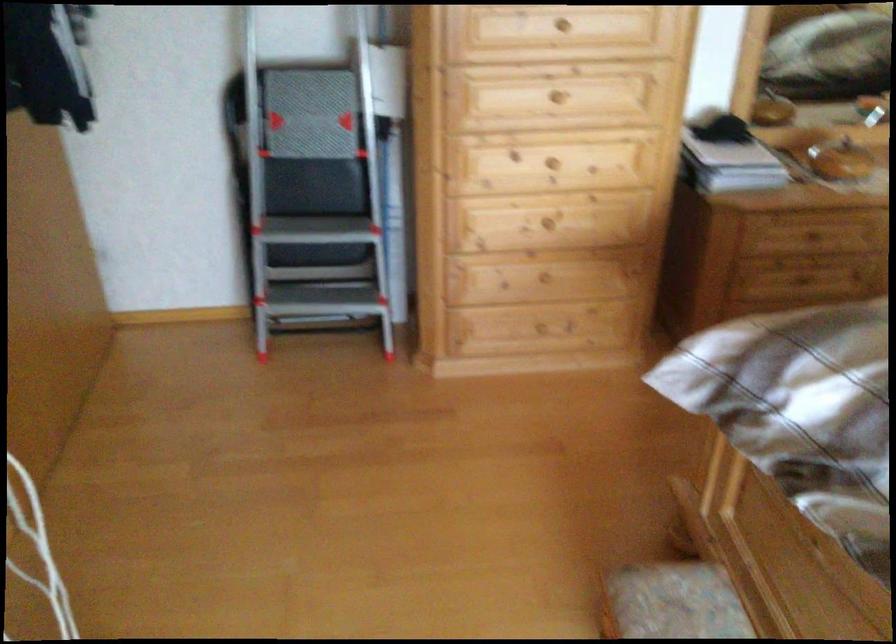
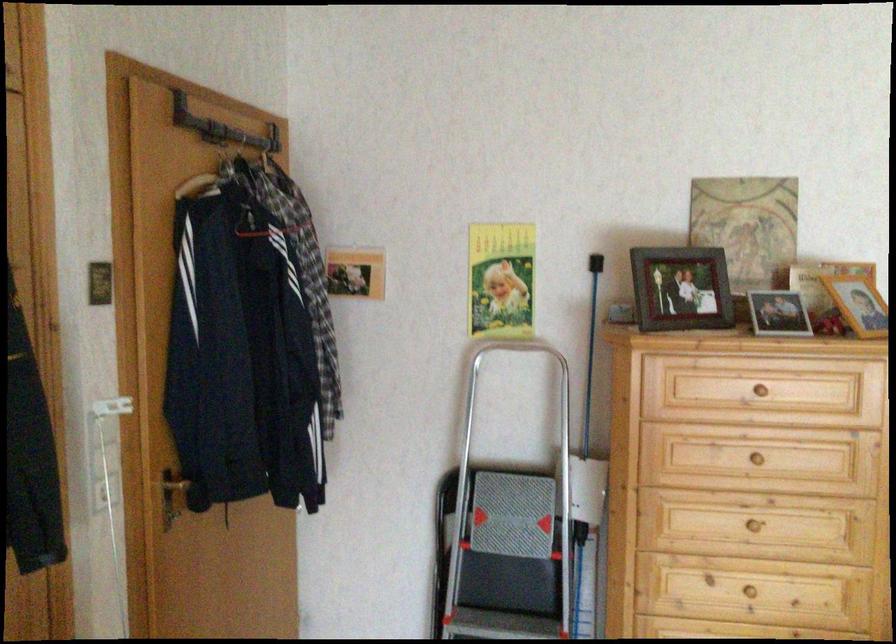
The point at (x=309, y=138) is marked in the first image. Where is the corresponding point in the second image?

(510, 536)